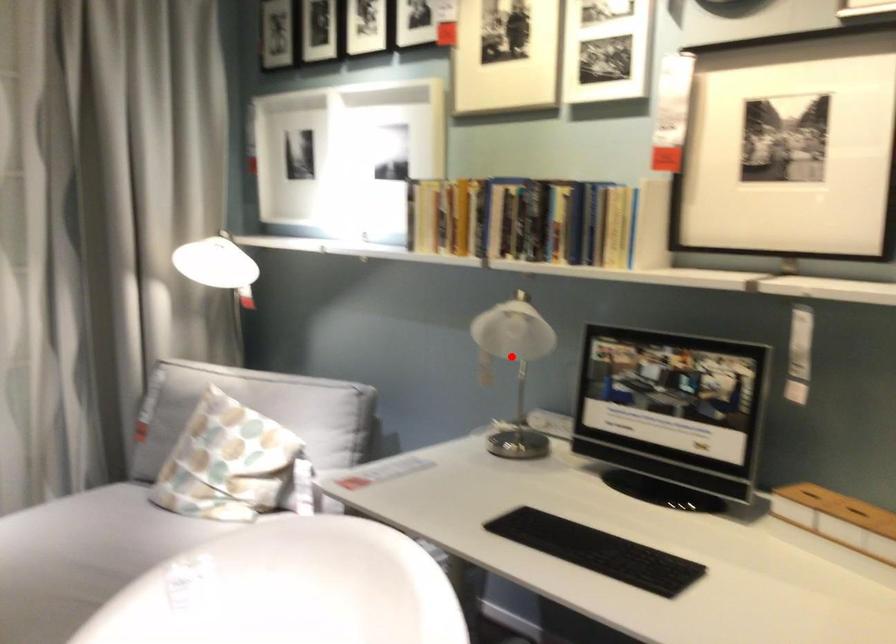
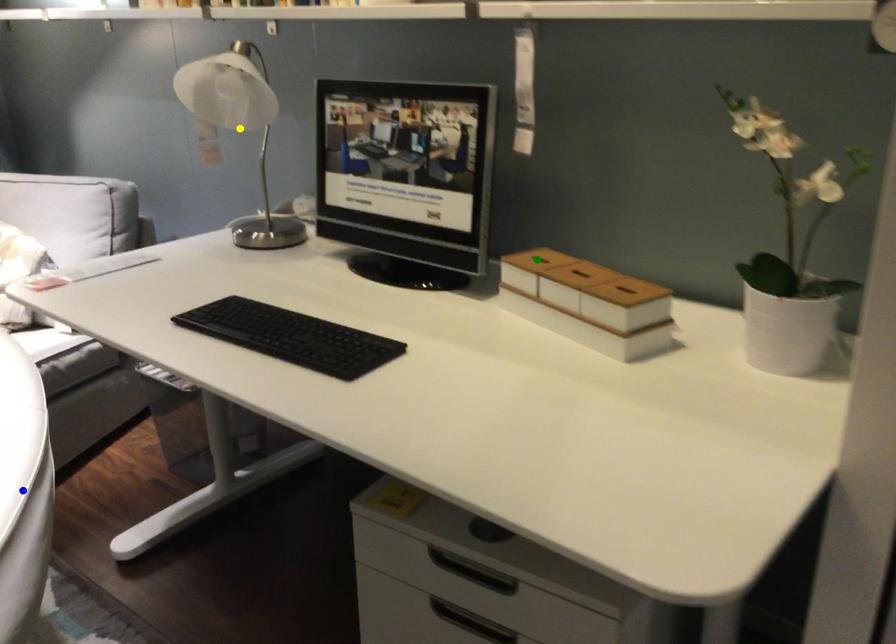
Question: I am providing you with two images of the same scene from different viewpoints. A red point is marked on the first image. You are given multiple points on the second image. Which mark in image 2 goes with the point in image 1?

Choices:
 (A) blue point
 (B) green point
 (C) yellow point

Answer: (C)